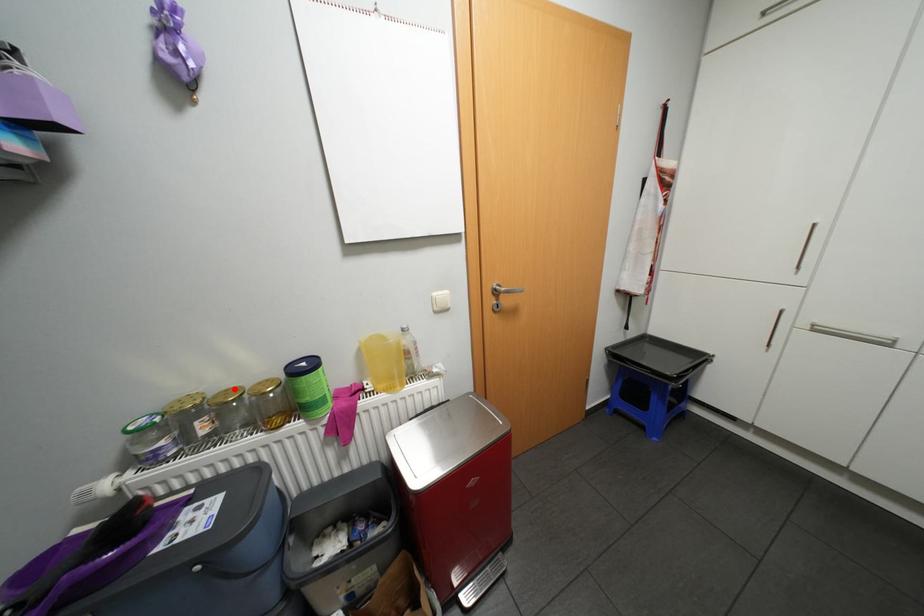
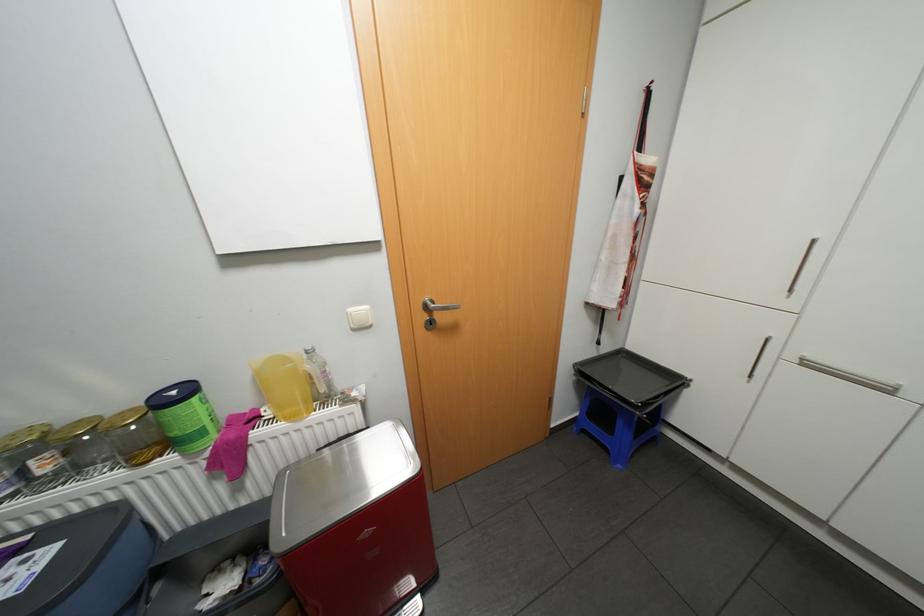
Where in the second image is the point corresponding to the highlighted location from the first image?

(88, 419)